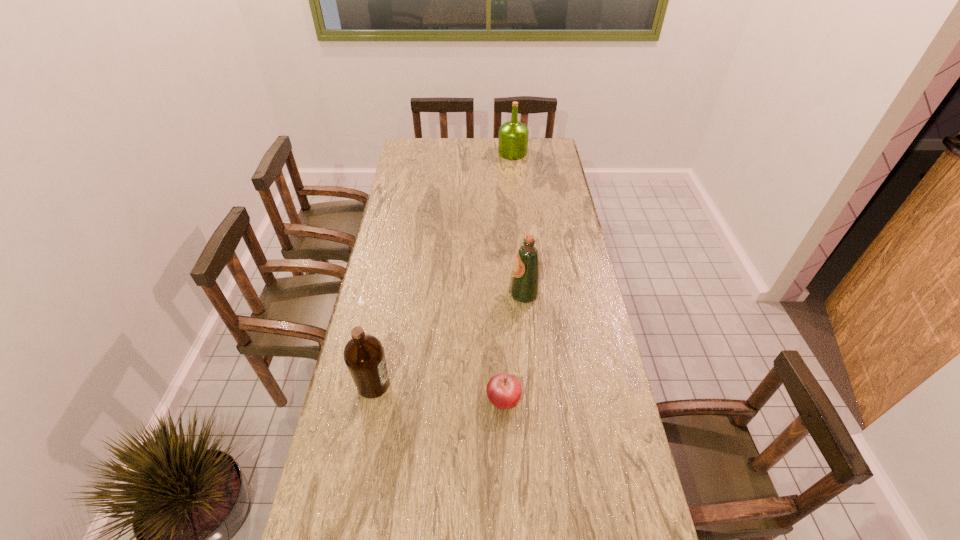
Find the location of a particular element. The image size is (960, 540). free space located on the right of the shortest object is located at coordinates (597, 399).

You are a GUI agent. You are given a task and a screenshot of the screen. Output one action in this format:
    pyautogui.click(x=<x>, y=<y>)
    Task: Click on the object that is at the far edge
    Image resolution: width=960 pixels, height=540 pixels.
    Given the screenshot: What is the action you would take?
    pyautogui.click(x=513, y=135)

The height and width of the screenshot is (540, 960). Find the location of `object that is at the left edge`. object that is at the left edge is located at coordinates (364, 356).

The height and width of the screenshot is (540, 960). What are the coordinates of `object located in the right edge section of the desktop` in the screenshot? It's located at (513, 135).

The image size is (960, 540). What are the coordinates of `object at the far right corner` in the screenshot? It's located at (513, 135).

Locate an element on the screen. The image size is (960, 540). vacant space at the far edge of the desktop is located at coordinates (464, 161).

The width and height of the screenshot is (960, 540). What are the coordinates of `free location at the left edge of the desktop` in the screenshot? It's located at (419, 174).

Identify the location of vacant space at the right edge. This screenshot has width=960, height=540. (571, 444).

Where is `vacant area at the far left corner`? vacant area at the far left corner is located at coordinates (432, 143).

Find the location of a particular element. free region at the far right corner of the desktop is located at coordinates (546, 161).